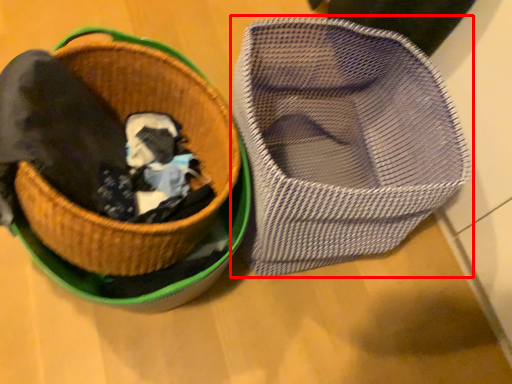
Question: Considering the relative positions of footwear (annotated by the red box) and basket in the image provided, where is footwear (annotated by the red box) located with respect to the staircase?

Choices:
 (A) right
 (B) left

Answer: (A)